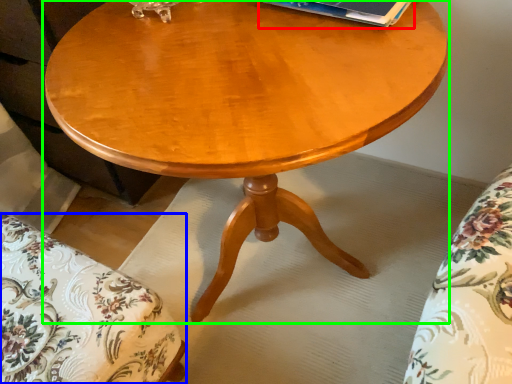
Question: Estimate the real-world distances between objects in this image. Which object is closer to paperback book (highlighted by a red box), swivel chair (highlighted by a blue box) or coffee table (highlighted by a green box)?

Choices:
 (A) swivel chair
 (B) coffee table

Answer: (B)